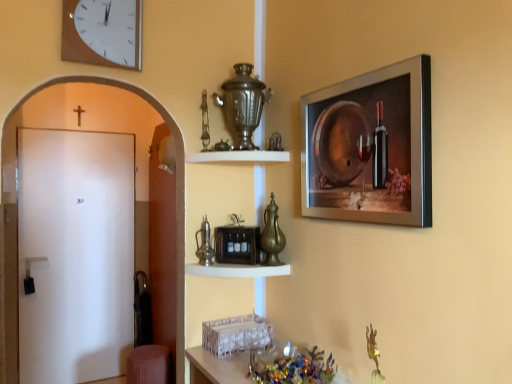
Locate an element on the screen. free point above white matte door at left (from a real-world perspective) is located at coordinates (81, 133).